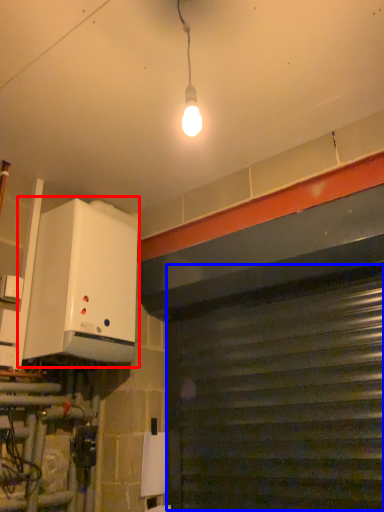
Question: Which object is closer to the camera taking this photo, appliance (highlighted by a red box) or garage door (highlighted by a blue box)?

Choices:
 (A) appliance
 (B) garage door

Answer: (B)